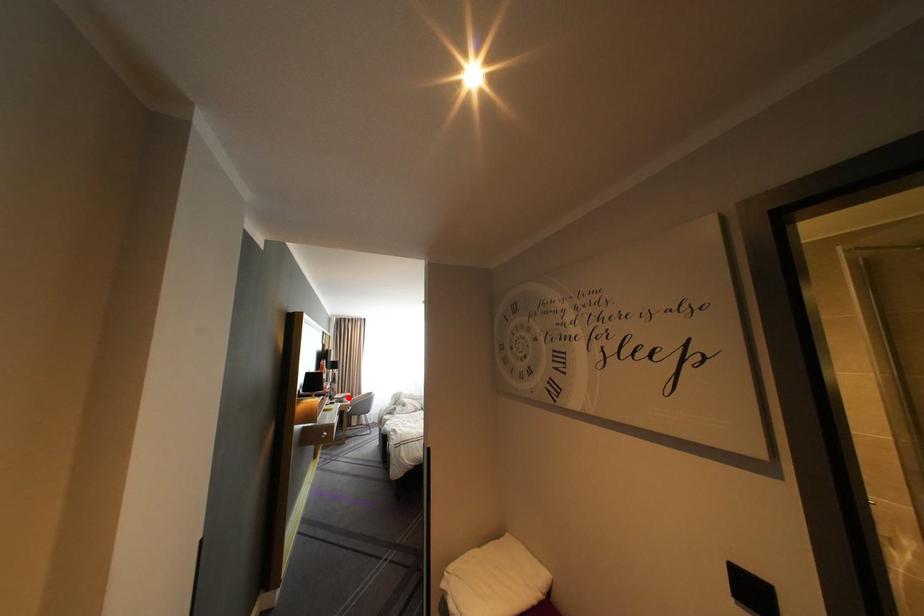
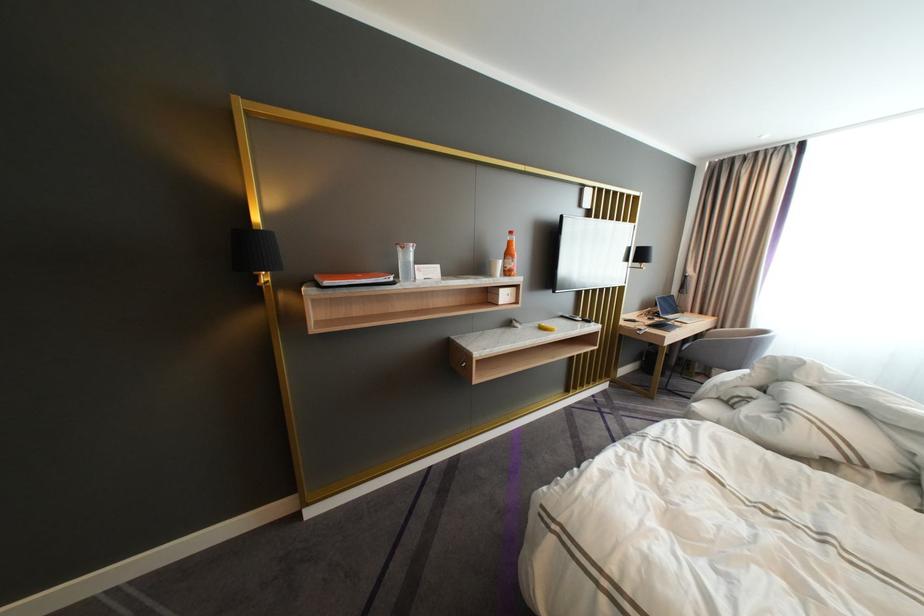
Locate, in the second image, the point that corresponds to the highlighted location in the first image.

(683, 317)